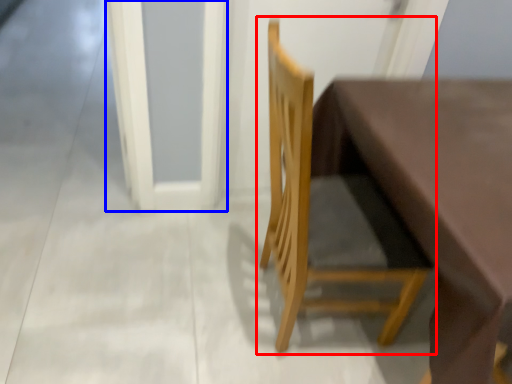
Question: Which object is further to the camera taking this photo, chair (highlighted by a red box) or screen door (highlighted by a blue box)?

Choices:
 (A) chair
 (B) screen door

Answer: (B)